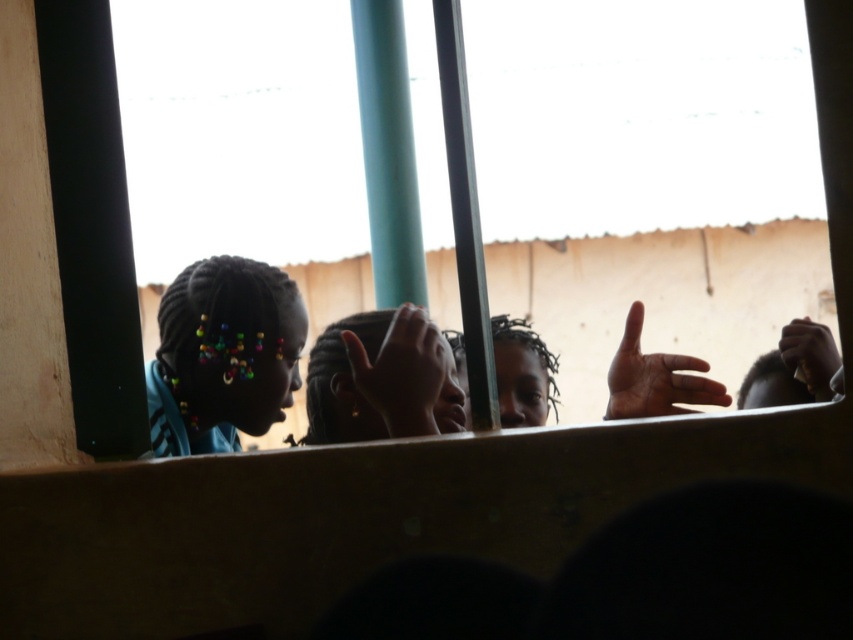
Question: Based on their relative distances, which object is farther from the multicolored beaded hair at left?

Choices:
 (A) dark skin hair at center
 (B) brown matte hand at center

Answer: (B)

Question: Is transparent glass at upper center further to the viewer compared to multicolored beaded hair at left?

Choices:
 (A) yes
 (B) no

Answer: (B)

Question: Which point is closer to the camera?

Choices:
 (A) brown matte hand at center
 (B) smooth skin hand at center
 (C) smooth brown hand at right
 (D) multicolored beaded hair at left

Answer: (C)

Question: In this image, where is dark skin hair at center located relative to smooth brown hand at right?

Choices:
 (A) below
 (B) above

Answer: (B)

Question: Which object is farther from the camera taking this photo?

Choices:
 (A) transparent glass at upper center
 (B) smooth skin hand at center
 (C) brown matte hand at center

Answer: (A)

Question: Can you confirm if multicolored beaded hair at left is wider than smooth brown hand at right?

Choices:
 (A) yes
 (B) no

Answer: (A)